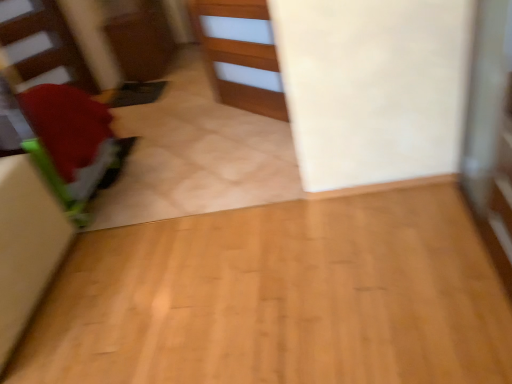
In order to click on green fabric cushion at left in this screenshot , I will do `click(72, 143)`.

From a real-world perspective, who is located lower, wooden cabinet at center or green fabric cushion at left?

In real-world perspective, wooden cabinet at center is lower.

Is wooden cabinet at center smaller than green fabric cushion at left?

A: Yes.

Locate an element on the screen. The image size is (512, 384). furniture lying in front of the wooden cabinet at center is located at coordinates (72, 143).

Which is in front, wooden cabinet at center or green fabric cushion at left?

green fabric cushion at left is closer to the camera.

In the image, there is a wooden cabinet at center. At what (x,y) coordinates should I click in order to perform the action: click on stairwell above it (from the image's perspective). Please return your answer as a coordinate pair (x, y). The width and height of the screenshot is (512, 384). Looking at the image, I should click on (41, 46).

In the scene shown: From the image's perspective, which one is positioned lower, matte red stairwell at left or wooden cabinet at center?

From the image's view, wooden cabinet at center is below.

Can you tell me how much matte red stairwell at left and wooden cabinet at center differ in facing direction?

69.6 degrees separate the facing orientations of matte red stairwell at left and wooden cabinet at center.

Which is less distant, (42, 40) or (259, 64)?

The point (259, 64) is in front.

Who is shorter, green fabric cushion at left or matte red stairwell at left?

Standing shorter between the two is green fabric cushion at left.

Which point is more forward, (x=22, y=98) or (x=56, y=52)?

The point (x=22, y=98) is more forward.

The height and width of the screenshot is (384, 512). Identify the location of stairwell behind the green fabric cushion at left. (41, 46).

Looking at this image, what's the angular difference between green fabric cushion at left and wooden cabinet at center's facing directions?

The angular difference between green fabric cushion at left and wooden cabinet at center is 155 degrees.

From the image's perspective, is green fabric cushion at left located above or below wooden cabinet at center?

Clearly, from the image's perspective, green fabric cushion at left is below wooden cabinet at center.

Measure the distance between green fabric cushion at left and wooden cabinet at center.

green fabric cushion at left and wooden cabinet at center are 99.88 centimeters apart from each other.

Which object is closer to the camera, green fabric cushion at left or wooden cabinet at center?

Positioned in front is green fabric cushion at left.

Which of these two, matte red stairwell at left or green fabric cushion at left, stands taller?

With more height is matte red stairwell at left.

The height and width of the screenshot is (384, 512). In order to click on stairwell behind the green fabric cushion at left in this screenshot , I will do [41, 46].

From a real-world perspective, is matte red stairwell at left on green fabric cushion at left?

Indeed, from a real-world perspective, matte red stairwell at left stands above green fabric cushion at left.

Are matte red stairwell at left and green fabric cushion at left beside each other?

No, matte red stairwell at left is not with green fabric cushion at left.

Considering the sizes of wooden cabinet at center and matte red stairwell at left in the image, is wooden cabinet at center taller or shorter than matte red stairwell at left?

Considering their sizes, wooden cabinet at center has less height than matte red stairwell at left.

Which is farther, [228,57] or [72,57]?

Point [72,57]

The width and height of the screenshot is (512, 384). I want to click on stairwell that is behind the wooden cabinet at center, so click(41, 46).

Is wooden cabinet at center to the right of matte red stairwell at left from the viewer's perspective?

Yes, wooden cabinet at center is to the right of matte red stairwell at left.

The image size is (512, 384). In order to click on cabinetry above the green fabric cushion at left (from the image's perspective) in this screenshot , I will do `click(241, 54)`.

Locate an element on the screen. This screenshot has width=512, height=384. stairwell that appears on the left of wooden cabinet at center is located at coordinates (41, 46).

From the image, which object appears to be nearer to matte red stairwell at left, wooden cabinet at center or green fabric cushion at left?

Among the two, green fabric cushion at left is located nearer to matte red stairwell at left.

Looking at the image, which one is located closer to wooden cabinet at center, matte red stairwell at left or green fabric cushion at left?

green fabric cushion at left is positioned closer to the anchor wooden cabinet at center.

Looking at the image, which one is located closer to wooden cabinet at center, green fabric cushion at left or matte red stairwell at left?

Based on the image, green fabric cushion at left appears to be nearer to wooden cabinet at center.

When comparing their distances from matte red stairwell at left, does green fabric cushion at left or wooden cabinet at center seem closer?

green fabric cushion at left is closer to matte red stairwell at left.

Which object lies nearer to the anchor point green fabric cushion at left, matte red stairwell at left or wooden cabinet at center?

wooden cabinet at center is positioned closer to the anchor green fabric cushion at left.

Estimate the real-world distances between objects in this image. Which object is further from green fabric cushion at left, wooden cabinet at center or matte red stairwell at left?

Among the two, matte red stairwell at left is located further to green fabric cushion at left.

At what (x,y) coordinates should I click in order to perform the action: click on furniture situated between matte red stairwell at left and wooden cabinet at center from left to right. Please return your answer as a coordinate pair (x, y). Looking at the image, I should click on (72, 143).